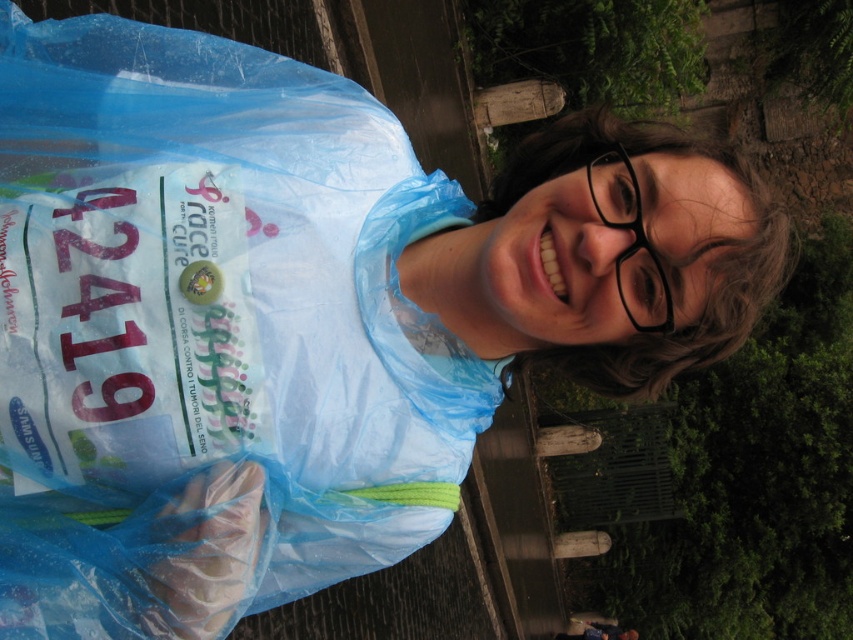
Does point (50, 216) lie behind point (607, 157)?

No, it is in front of (607, 157).

Is translucent blue plastic bag at center bigger than black plastic glasses at upper right?

Correct, translucent blue plastic bag at center is larger in size than black plastic glasses at upper right.

I want to click on translucent blue plastic bag at center, so click(x=222, y=285).